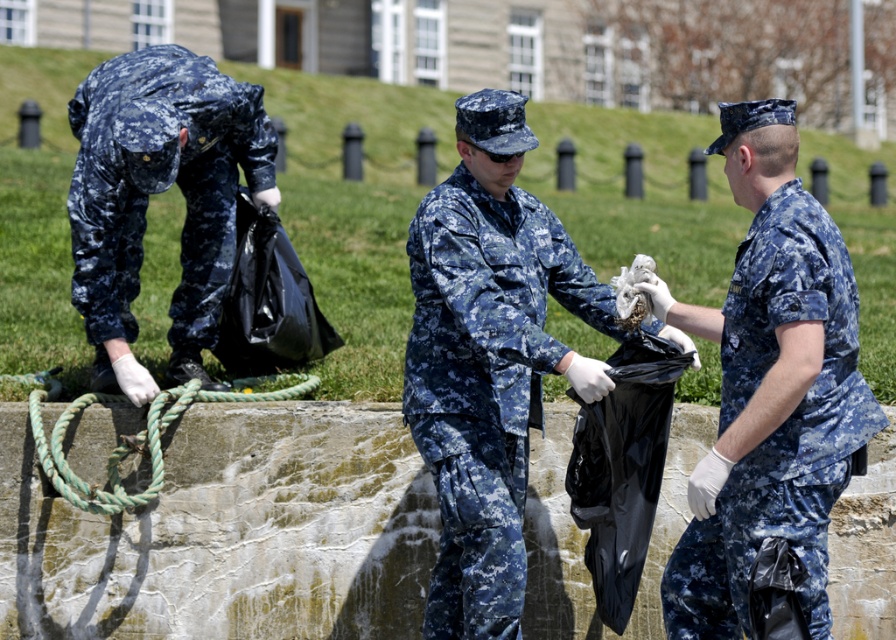
Is digital camouflage uniform at left thinner than green rough rope at center?

Indeed, digital camouflage uniform at left has a lesser width compared to green rough rope at center.

Does digital camouflage uniform at left come in front of green rough rope at center?

No, it is not.

The height and width of the screenshot is (640, 896). What are the coordinates of `digital camouflage uniform at left` in the screenshot? It's located at (160, 182).

Image resolution: width=896 pixels, height=640 pixels. In order to click on digital camouflage uniform at left in this screenshot , I will do `click(160, 182)`.

Consider the image. Can you confirm if camouflage fabric uniform at center is wider than digital camouflage uniform at left?

Correct, the width of camouflage fabric uniform at center exceeds that of digital camouflage uniform at left.

This screenshot has width=896, height=640. Describe the element at coordinates (487, 378) in the screenshot. I see `camouflage fabric uniform at center` at that location.

You are a GUI agent. You are given a task and a screenshot of the screen. Output one action in this format:
    pyautogui.click(x=<x>, y=<y>)
    Task: Click on the camouflage fabric uniform at center
    The width and height of the screenshot is (896, 640).
    Given the screenshot: What is the action you would take?
    pyautogui.click(x=487, y=378)

Does digital camouflage uniform at left have a lesser height compared to digital camouflage uniform at right?

Correct, digital camouflage uniform at left is not as tall as digital camouflage uniform at right.

Does digital camouflage uniform at left have a smaller size compared to digital camouflage uniform at right?

Yes, digital camouflage uniform at left is smaller than digital camouflage uniform at right.

Does point (203, 134) come farther from viewer compared to point (780, 188)?

Yes.

Locate an element on the screen. The height and width of the screenshot is (640, 896). digital camouflage uniform at left is located at coordinates (160, 182).